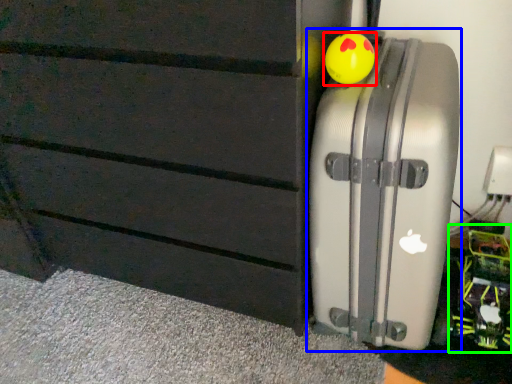
Question: Which object is the farthest from toy (highlighted by a red box)? Choose among these: suitcase (highlighted by a blue box) or toy (highlighted by a green box).

Choices:
 (A) suitcase
 (B) toy

Answer: (B)